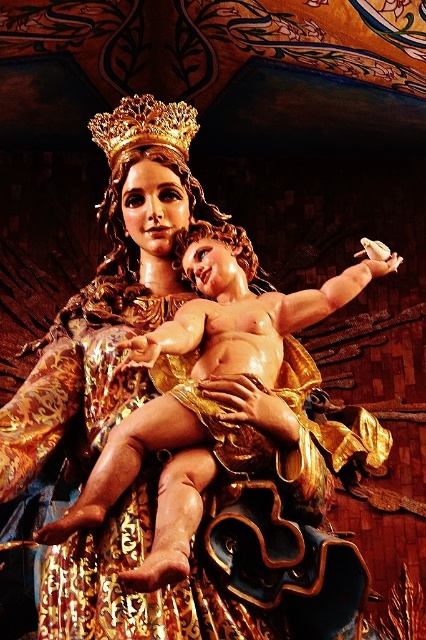
You are an art conservator examining the statue. You need to determine if the smooth gold baby at center can be placed on top of the gold metallic crown at upper center without exceeding the crown base. Based on their heights, is this possible?

The smooth gold baby at center has a greater height compared to the gold metallic crown at upper center. Therefore, placing the smooth gold baby at center on top of the gold metallic crown at upper center would not be feasible due to its larger height exceeding the crown base.

You are an art conservator examining the statue from the front. You notice two points on the statue marked at coordinates point (276, 326) and point (169, 134). Which point is closer to you?

Point (276, 326) is in front of point (169, 134), so it is closer to you.

You are an art conservator tasked with placing a protective glass shield around the statue. The shield must accommodate both the smooth gold baby at center and the gold metallic crown at upper center. Which object requires a wider space in the shield to ensure proper protection?

The smooth gold baby at center requires a wider space in the shield because its width is larger than that of the gold metallic crown at upper center.